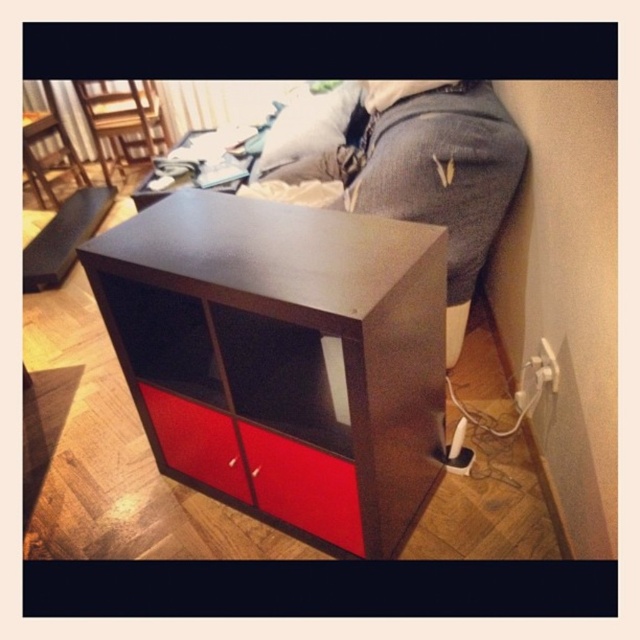
Is matte red drawer at lower center positioned before matte black side table at upper center?

Yes, matte red drawer at lower center is in front of matte black side table at upper center.

Is matte red drawer at lower center taller than matte black side table at upper center?

Yes, matte red drawer at lower center is taller than matte black side table at upper center.

Locate an element on the screen. The width and height of the screenshot is (640, 640). matte red drawer at lower center is located at coordinates (259, 468).

Which is in front, point (227, 269) or point (323, 484)?

Point (227, 269) is in front.

Can you confirm if matte black cabinet at center is thinner than matte red drawer at lower center?

In fact, matte black cabinet at center might be wider than matte red drawer at lower center.

The width and height of the screenshot is (640, 640). Find the location of `matte black cabinet at center`. matte black cabinet at center is located at coordinates (282, 356).

Where is `matte black cabinet at center`? matte black cabinet at center is located at coordinates (282, 356).

Which is more to the left, matte black cabinet at center or matte black side table at upper center?

Positioned to the left is matte black side table at upper center.

Is point (400, 472) in front of point (227, 189)?

Yes, it is in front of point (227, 189).

I want to click on matte black cabinet at center, so click(x=282, y=356).